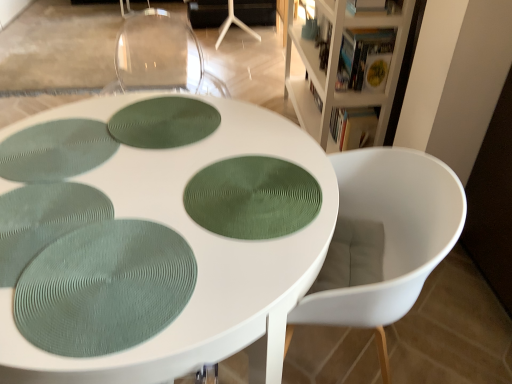
Identify the location of empty space that is in between green textured placemat at center, the 3th oval from the front, and green textured placemat at lower left, marked as the 3th oval in a back-to-front arrangement. This screenshot has width=512, height=384. (144, 187).